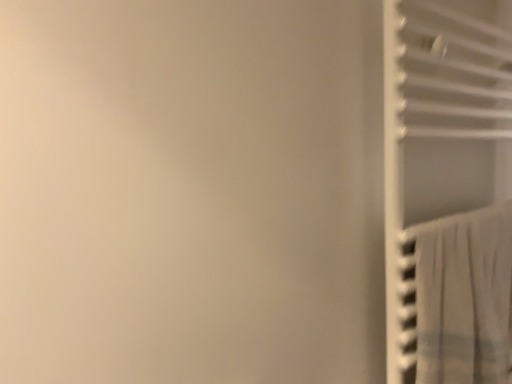
Image resolution: width=512 pixels, height=384 pixels. What do you see at coordinates (439, 136) in the screenshot? I see `white plastic closet at right` at bounding box center [439, 136].

You are a GUI agent. You are given a task and a screenshot of the screen. Output one action in this format:
    pyautogui.click(x=<x>, y=<y>)
    Task: Click on the white plastic closet at right
    
    Given the screenshot: What is the action you would take?
    pyautogui.click(x=439, y=136)

In order to face white sheer curtain at right, should I rotate leftwards or rightwards?

To align with it, rotate right about 24.817°.

What do you see at coordinates (465, 298) in the screenshot?
I see `white sheer curtain at right` at bounding box center [465, 298].

Measure the distance between white sheer curtain at right and camera.

They are 27.25 inches apart.

Where is `white sheer curtain at right`? The width and height of the screenshot is (512, 384). white sheer curtain at right is located at coordinates (465, 298).

Find the location of a particular element. The width and height of the screenshot is (512, 384). white plastic closet at right is located at coordinates (439, 136).

Looking at this image, visually, is white plastic closet at right positioned to the left or to the right of white sheer curtain at right?

white plastic closet at right is to the right of white sheer curtain at right.

Considering the positions of objects white plastic closet at right and white sheer curtain at right in the image provided, who is in front, white plastic closet at right or white sheer curtain at right?

white plastic closet at right is more forward.

Looking at this image, which is less distant, (482, 48) or (501, 350)?

Point (482, 48).

From the image's perspective, relative to white sheer curtain at right, is white plastic closet at right above or below?

From the image's perspective, white plastic closet at right appears above white sheer curtain at right.

In the scene shown: From a real-world perspective, is white plastic closet at right below white sheer curtain at right?

No, from a real-world perspective, white plastic closet at right is not below white sheer curtain at right.

Which object is thinner, white plastic closet at right or white sheer curtain at right?

Thinner between the two is white sheer curtain at right.

Who is taller, white plastic closet at right or white sheer curtain at right?

Standing taller between the two is white plastic closet at right.

Who is bigger, white plastic closet at right or white sheer curtain at right?

white plastic closet at right.

Which is correct: white plastic closet at right is inside white sheer curtain at right, or outside of it?

The correct answer is: outside.

Are white plastic closet at right and white sheer curtain at right beside each other?

No, white plastic closet at right is not beside white sheer curtain at right.

Is white plastic closet at right facing towards white sheer curtain at right?

Yes, white plastic closet at right is facing white sheer curtain at right.

Image resolution: width=512 pixels, height=384 pixels. I want to click on closet lying in front of the white sheer curtain at right, so click(x=439, y=136).

Can you confirm if white sheer curtain at right is positioned to the left of white plastic closet at right?

Indeed, white sheer curtain at right is positioned on the left side of white plastic closet at right.

Which object is more forward, white sheer curtain at right or white plastic closet at right?

white plastic closet at right is more forward.

Which is behind, point (482, 238) or point (424, 190)?

Positioned behind is point (424, 190).

From the image's perspective, is white sheer curtain at right on white plastic closet at right?

No.

From a real-world perspective, is white sheer curtain at right beneath white plastic closet at right?

Yes, from a real-world perspective, white sheer curtain at right is under white plastic closet at right.

Is white sheer curtain at right wider or thinner than white plastic closet at right?

In the image, white sheer curtain at right appears to be more narrow than white plastic closet at right.

In terms of height, does white sheer curtain at right look taller or shorter compared to white plastic closet at right?

white sheer curtain at right is shorter than white plastic closet at right.

Is white sheer curtain at right bigger than white plastic closet at right?

No, white sheer curtain at right is not bigger than white plastic closet at right.

Is white sheer curtain at right completely or partially outside of white plastic closet at right?

Actually, white sheer curtain at right is within white plastic closet at right.

Are white sheer curtain at right and white plastic closet at right located far from each other?

Actually, white sheer curtain at right and white plastic closet at right are a little close together.

Is white sheer curtain at right facing towards white plastic closet at right?

Yes, white sheer curtain at right is facing white plastic closet at right.

How far apart are white sheer curtain at right and white plastic closet at right?

The distance of white sheer curtain at right from white plastic closet at right is 17.49 centimeters.

Where is `closet above the white sheer curtain at right (from a real-world perspective)`? closet above the white sheer curtain at right (from a real-world perspective) is located at coordinates (439, 136).

You are a GUI agent. You are given a task and a screenshot of the screen. Output one action in this format:
    pyautogui.click(x=<x>, y=<y>)
    Task: Click on the curtain located behind the white plastic closet at right
    
    Given the screenshot: What is the action you would take?
    pyautogui.click(x=465, y=298)

You are a GUI agent. You are given a task and a screenshot of the screen. Output one action in this format:
    pyautogui.click(x=<x>, y=<y>)
    Task: Click on the curtain below the white plastic closet at right (from the image's perspective)
    Image resolution: width=512 pixels, height=384 pixels.
    Given the screenshot: What is the action you would take?
    pyautogui.click(x=465, y=298)